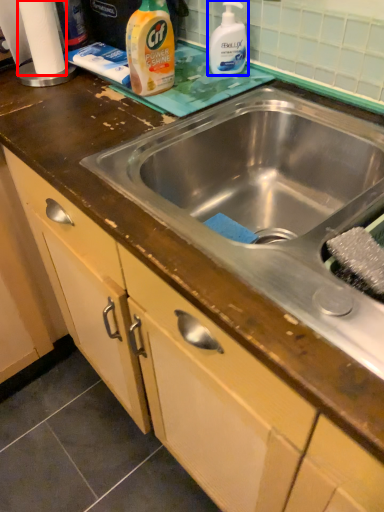
Question: Which object is closer to the camera taking this photo, toilet paper (highlighted by a red box) or cleaning product (highlighted by a blue box)?

Choices:
 (A) toilet paper
 (B) cleaning product

Answer: (B)